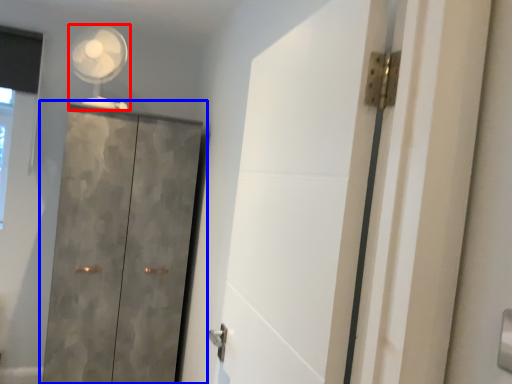
Question: Which object is further to the camera taking this photo, mechanical fan (highlighted by a red box) or cupboard (highlighted by a blue box)?

Choices:
 (A) mechanical fan
 (B) cupboard

Answer: (A)